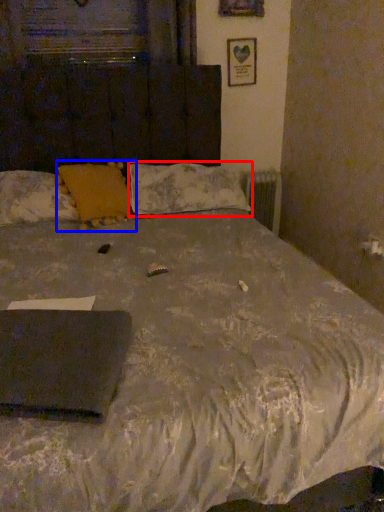
Question: Which object appears closest to the camera in this image, pillow (highlighted by a red box) or pillow (highlighted by a blue box)?

Choices:
 (A) pillow
 (B) pillow

Answer: (B)